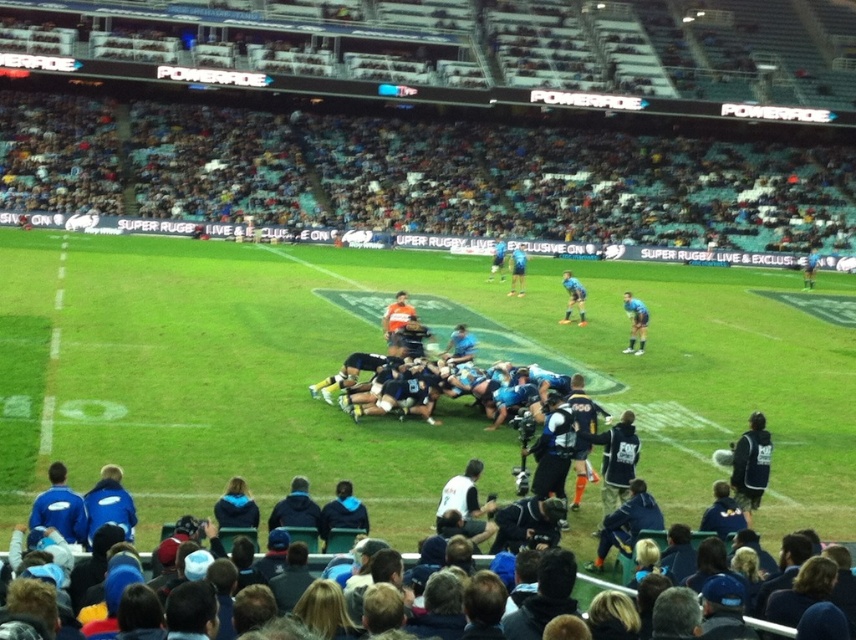
You are a photographer at the rugby match. You want to take a photo that includes both the blue fabric seats at upper center and the blue fabric shirt at center. Which object should you focus on first to ensure both are in the frame?

The blue fabric seats at upper center is above the blue fabric shirt at center, so you should focus on the blue fabric shirt at center first to ensure both are in the frame.

You are a spectator trying to find your seat in the stadium. You see the blue fabric seats at upper center. Based on their location, can you estimate how far they are from the edge of the field?

The blue fabric seats at upper center are located at point (488,179), which is relatively close to the edge of the field, so they are likely within a short distance from the field edge.